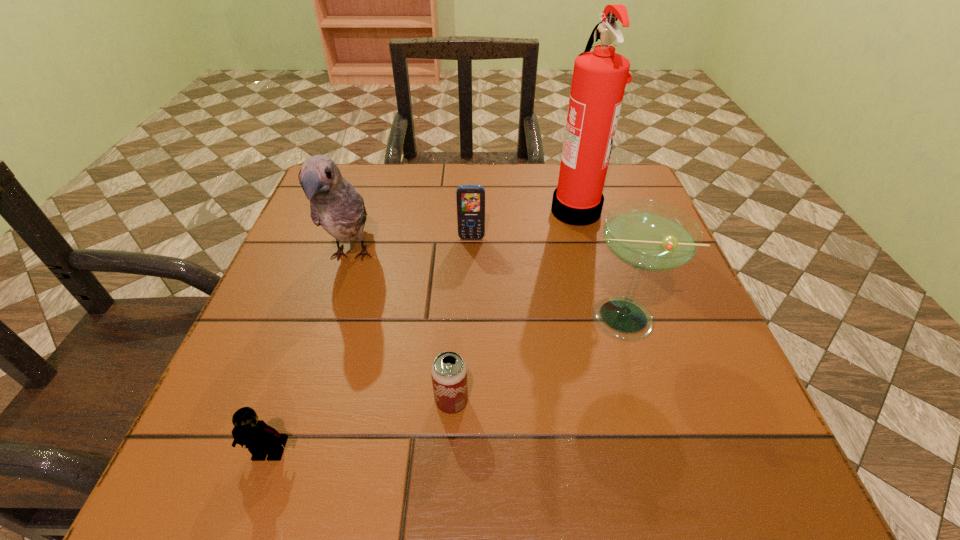
Where is `fire extinguisher`? Image resolution: width=960 pixels, height=540 pixels. fire extinguisher is located at coordinates (599, 79).

What are the coordinates of `parrot` in the screenshot? It's located at (334, 203).

Where is `the third tallest object`? Image resolution: width=960 pixels, height=540 pixels. the third tallest object is located at coordinates (647, 235).

This screenshot has height=540, width=960. Identify the location of cellular telephone. (470, 199).

At what (x,y) coordinates should I click in order to perform the action: click on Lego. Please return your answer as a coordinate pair (x, y). Image resolution: width=960 pixels, height=540 pixels. Looking at the image, I should click on (261, 439).

This screenshot has width=960, height=540. In order to click on beer can in this screenshot , I will do `click(449, 371)`.

Identify the location of vacant space located 0.340m with the nozzle aimed from the tallest object. The height and width of the screenshot is (540, 960). pos(411,209).

At what (x,y) coordinates should I click in order to perform the action: click on free space located 0.160m with the nozzle aimed from the tallest object. Please return your answer as a coordinate pair (x, y). This screenshot has height=540, width=960. Looking at the image, I should click on (485, 209).

Where is `vacant space located with the nozzle aimed from the tallest object`? The image size is (960, 540). vacant space located with the nozzle aimed from the tallest object is located at coordinates (423, 209).

Identify the location of vacant region located on the front-facing side of the parrot. [x=292, y=442].